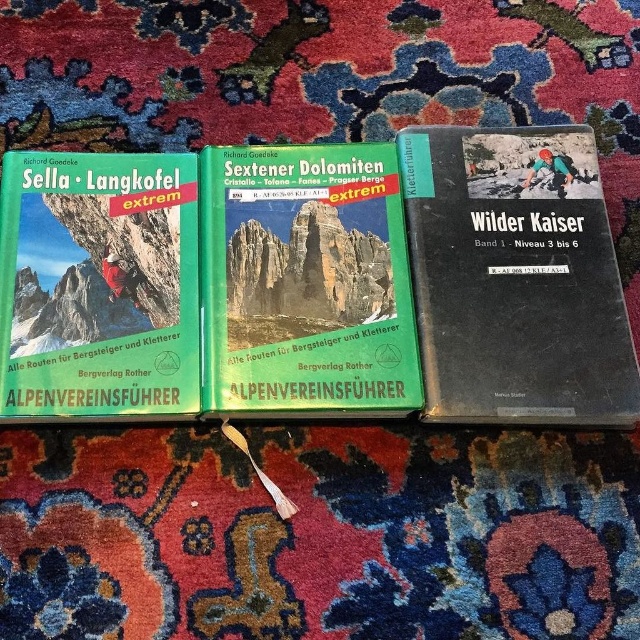
You are a book collector who wants to place a new book between the black matte book at right and the green matte book at center. The new book is 3 inches thick. Is there enough space between them to fit the new book?

The black matte book at right and green matte book at center are 7.02 inches apart from each other. Since the new book is 3 inches thick, there is enough space between them to fit the new book.

You are a photographer standing 1.5 meters away from the green matte book at center. You want to take a closeup shot of it. Can you move closer to the book to get a better shot without exceeding the minimum focus distance of your lens, which is 0.5 meters?

The green matte book at center is 1.09 meters away from the camera. Since your minimum focus distance is 0.5 meters, you can move closer to the book to take the closeup shot as long as you stay at least 0.5 meters away.